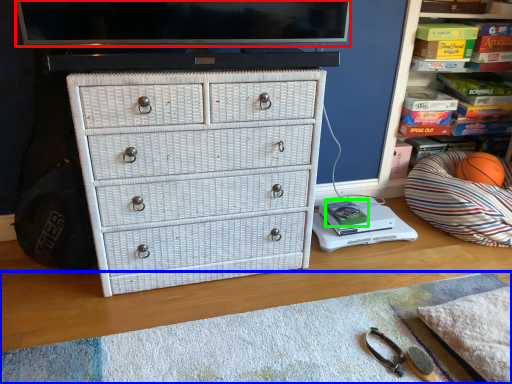
Question: Considering the real-world distances, which object is closest to television (highlighted by a red box)? plain (highlighted by a blue box) or book (highlighted by a green box).

Choices:
 (A) plain
 (B) book

Answer: (A)